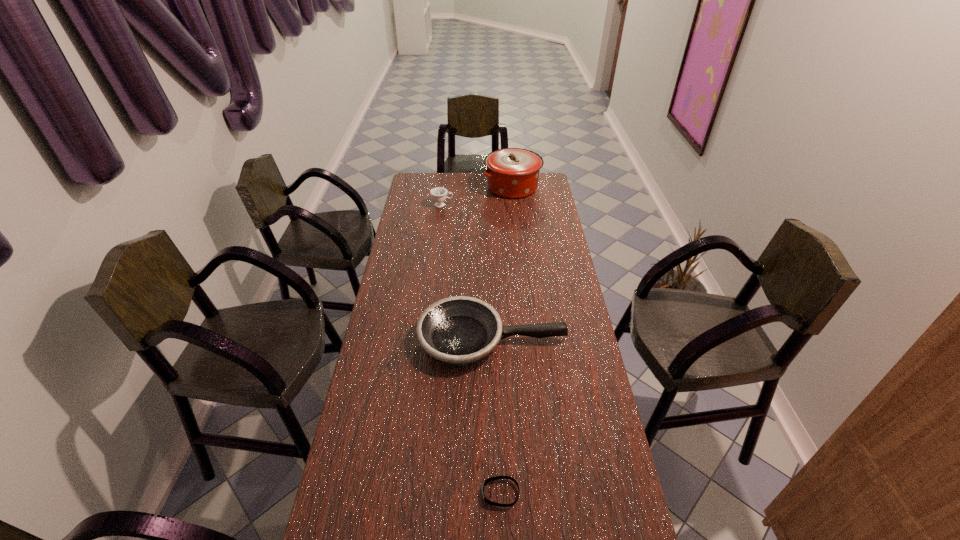
The height and width of the screenshot is (540, 960). I want to click on free space between the casserole and the teacup, so click(x=477, y=196).

Locate an element on the screen. vacant area that lies between the casserole and the teacup is located at coordinates (477, 196).

Where is `vacant area that lies between the teacup and the second nearest object`? Image resolution: width=960 pixels, height=540 pixels. vacant area that lies between the teacup and the second nearest object is located at coordinates (468, 272).

At what (x,y) coordinates should I click in order to perform the action: click on free space that is in between the teacup and the frying pan. Please return your answer as a coordinate pair (x, y). The width and height of the screenshot is (960, 540). Looking at the image, I should click on (468, 272).

Identify which object is the third nearest to the tallest object. Please provide its 2D coordinates. Your answer should be formatted as a tuple, i.e. [(x, y)], where the tuple contains the x and y coordinates of a point satisfying the conditions above.

[(487, 501)]

Locate an element on the screen. object that is the closest to the tallest object is located at coordinates (438, 194).